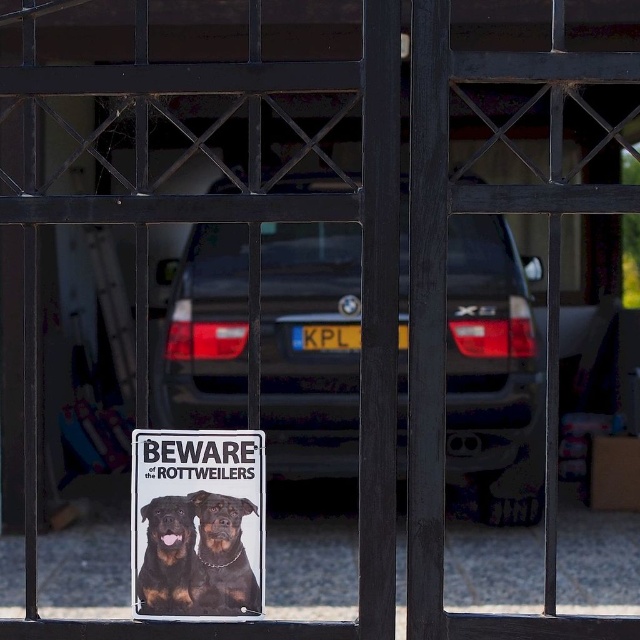
Question: Is metallic silver sign at center smaller than rottweiler at center?

Choices:
 (A) yes
 (B) no

Answer: (B)

Question: Which object appears closest to the camera in this image?

Choices:
 (A) rottweiler at center
 (B) brown fur dog at center

Answer: (A)

Question: Among these objects, which one is nearest to the camera?

Choices:
 (A) rottweiler at center
 (B) matte black car at center

Answer: (A)

Question: Can you confirm if metallic silver sign at center is thinner than brown fur dog at center?

Choices:
 (A) no
 (B) yes

Answer: (A)

Question: Which point is closer to the camera?

Choices:
 (A) (170, 605)
 (B) (236, 500)
 (C) (232, 522)

Answer: (B)

Question: Does metallic silver sign at center lie in front of brown fur dog at center?

Choices:
 (A) yes
 (B) no

Answer: (A)